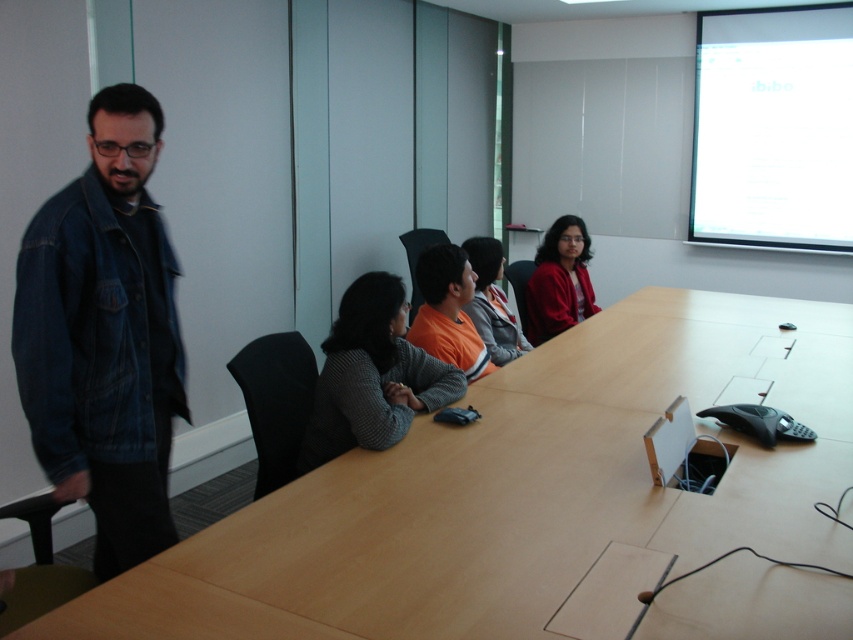
Question: Does denim jacket at left appear on the left side of gray wool sweater at center?

Choices:
 (A) no
 (B) yes

Answer: (B)

Question: Is the position of gray wool sweater at center less distant than that of orange fleece jacket at center?

Choices:
 (A) no
 (B) yes

Answer: (B)

Question: Considering the real-world distances, which object is farthest from the orange cotton shirt at center?

Choices:
 (A) matte red sweater at center
 (B) gray wool sweater at center
 (C) light brown wood table at center
 (D) denim jacket at left

Answer: (D)

Question: Is the position of light brown wood table at center less distant than that of gray wool sweater at center?

Choices:
 (A) yes
 (B) no

Answer: (A)

Question: Which point appears farthest from the camera in this image?

Choices:
 (A) (468, 252)
 (B) (810, 364)
 (C) (456, 273)
 (D) (114, 154)

Answer: (A)

Question: Which object is positioned closest to the orange cotton shirt at center?

Choices:
 (A) orange fleece jacket at center
 (B) denim jacket at left

Answer: (A)